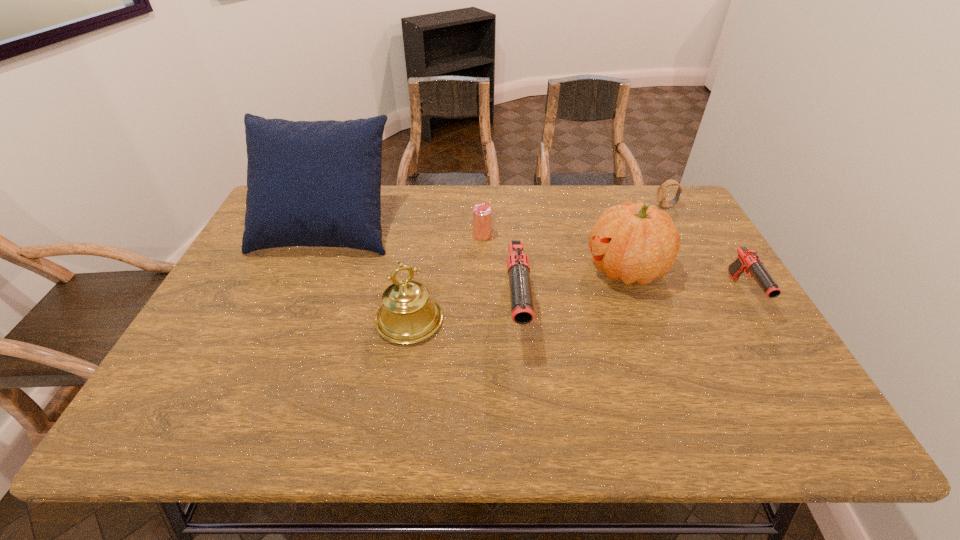
The image size is (960, 540). In order to click on vacant area between the taller gun and the rightmost object in this screenshot , I will do `click(630, 303)`.

Locate an element on the screen. The height and width of the screenshot is (540, 960). empty space that is in between the shorter gun and the cushion is located at coordinates (535, 260).

This screenshot has width=960, height=540. Find the location of `vacant space that is in between the second object from right to left and the shorter gun`. vacant space that is in between the second object from right to left and the shorter gun is located at coordinates (705, 250).

This screenshot has height=540, width=960. In order to click on object that is the third closest to the shorter gun in this screenshot , I will do `click(522, 309)`.

The image size is (960, 540). What are the coordinates of `object that is the second closest to the second object from left to right` in the screenshot? It's located at (310, 183).

Locate an element on the screen. This screenshot has height=540, width=960. free spot that satisfies the following two spatial constraints: 1. on the carved face of the pumpkin; 2. at the aiming end of the taller gun is located at coordinates (x=641, y=313).

At what (x,y) coordinates should I click in order to perform the action: click on vacant space that satisfies the following two spatial constraints: 1. on the carved face of the pumpkin; 2. at the aiming end of the left gun. Please return your answer as a coordinate pair (x, y). This screenshot has height=540, width=960. Looking at the image, I should click on (641, 313).

Where is `vacant area that satisfies the following two spatial constraints: 1. on the face of the watch; 2. on the facing side of the cushion`? vacant area that satisfies the following two spatial constraints: 1. on the face of the watch; 2. on the facing side of the cushion is located at coordinates (678, 227).